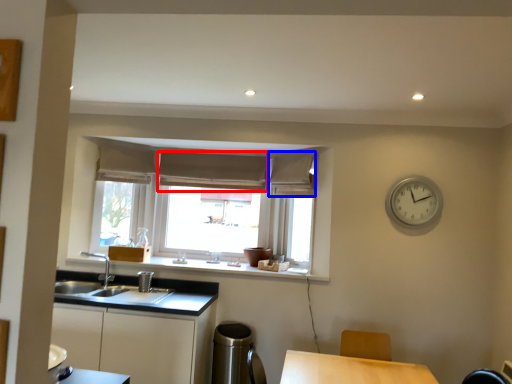
Question: Which object appears farthest to the camera in this image, curtain (highlighted by a red box) or curtain (highlighted by a blue box)?

Choices:
 (A) curtain
 (B) curtain

Answer: (A)